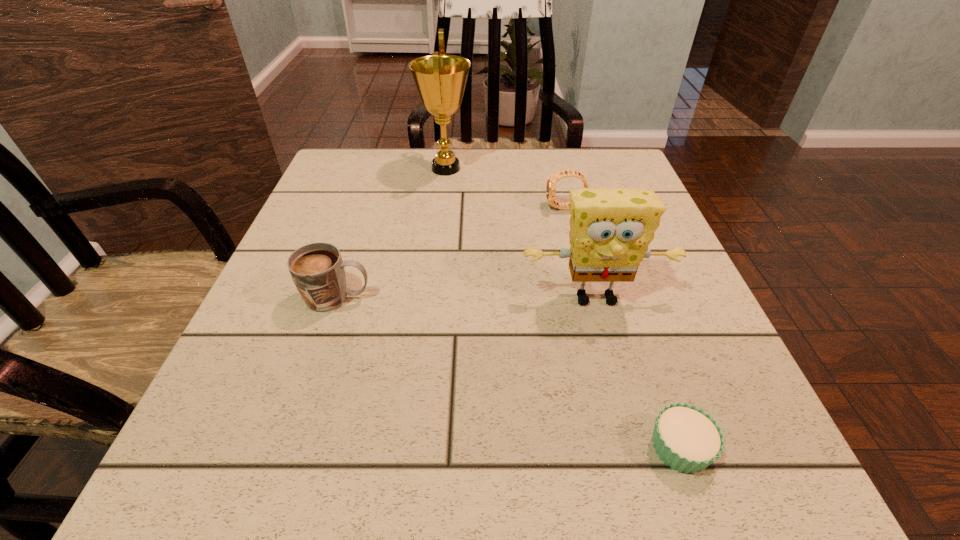
Locate an element on the screen. vacant area between the leftmost object and the sponge is located at coordinates (467, 298).

This screenshot has height=540, width=960. What are the coordinates of `free point between the nearest object and the leftmost object` in the screenshot? It's located at (509, 373).

The width and height of the screenshot is (960, 540). In order to click on free space between the shortest object and the sponge in this screenshot , I will do `click(637, 373)`.

The height and width of the screenshot is (540, 960). Find the location of `free space between the watch and the nearest object`. free space between the watch and the nearest object is located at coordinates (623, 327).

At what (x,y) coordinates should I click in order to perform the action: click on free spot between the sponge and the farthest object. Please return your answer as a coordinate pair (x, y). This screenshot has width=960, height=540. Looking at the image, I should click on (520, 233).

This screenshot has width=960, height=540. Find the location of `free space between the nearest object and the fourth nearest object`. free space between the nearest object and the fourth nearest object is located at coordinates (623, 327).

Choose which object is the nearest neighbor to the sponge. Please provide its 2D coordinates. Your answer should be formatted as a tuple, i.e. [(x, y)], where the tuple contains the x and y coordinates of a point satisfying the conditions above.

[(687, 439)]

The height and width of the screenshot is (540, 960). What are the coordinates of `object that is the second nearest to the nearest object` in the screenshot? It's located at (317, 269).

The image size is (960, 540). What are the coordinates of `vacant space that satisfies the following two spatial constraints: 1. on the face of the watch; 2. on the right side of the nearest object` in the screenshot? It's located at (625, 447).

What are the coordinates of `vacant space that satisfies the following two spatial constraints: 1. on the face of the cupcake; 2. on the right side of the sponge` in the screenshot? It's located at (636, 447).